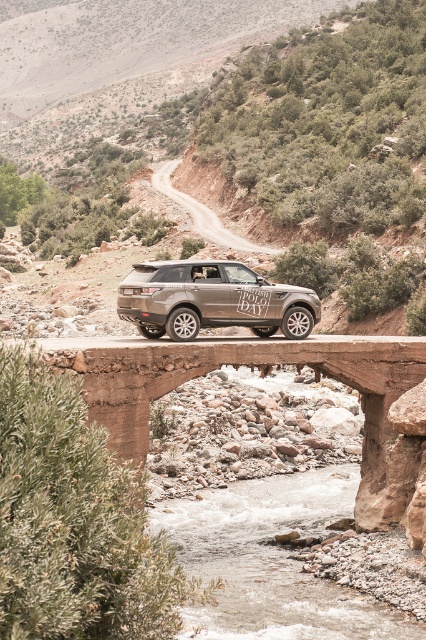
Between rustic stone bridge at center and matte metallic suv at center, which one appears on the left side from the viewer's perspective?

Positioned to the left is matte metallic suv at center.

Does rustic stone bridge at center have a smaller size compared to matte metallic suv at center?

No, rustic stone bridge at center is not smaller than matte metallic suv at center.

Does point (204, 352) come behind point (212, 321)?

No, (204, 352) is in front of (212, 321).

Find the location of a particular element. rustic stone bridge at center is located at coordinates (262, 372).

Is matte metallic suv at center positioned behind smooth gravel road at center?

No, matte metallic suv at center is closer to the viewer.

Does matte metallic suv at center have a lesser height compared to smooth gravel road at center?

Correct, matte metallic suv at center is not as tall as smooth gravel road at center.

Is point (123, 305) farther from viewer compared to point (203, 209)?

No, (123, 305) is in front of (203, 209).

Find the location of a particular element. This screenshot has height=640, width=426. matte metallic suv at center is located at coordinates (213, 300).

Is point (270, 586) behind point (166, 180)?

No, it is in front of (166, 180).

Which is below, clear water at center or smooth gravel road at center?

clear water at center

What do you see at coordinates (271, 561) in the screenshot? I see `clear water at center` at bounding box center [271, 561].

Image resolution: width=426 pixels, height=640 pixels. I want to click on clear water at center, so click(x=271, y=561).